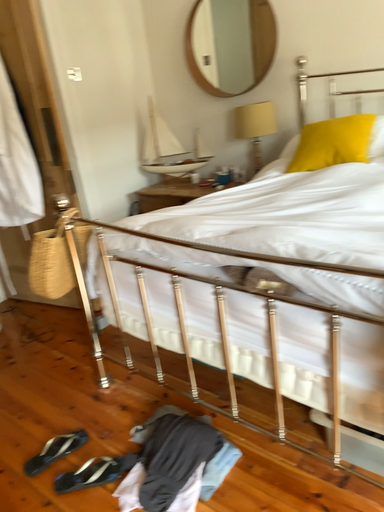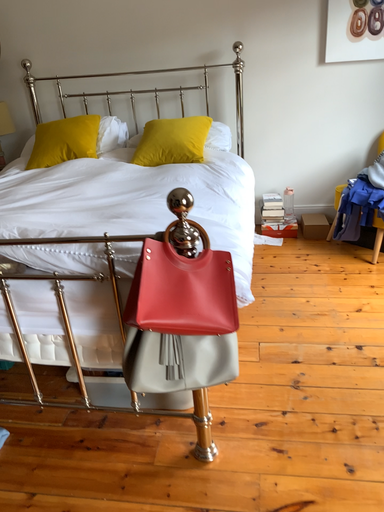
Question: Which way did the camera rotate in the video?

Choices:
 (A) rotated left
 (B) rotated right

Answer: (B)